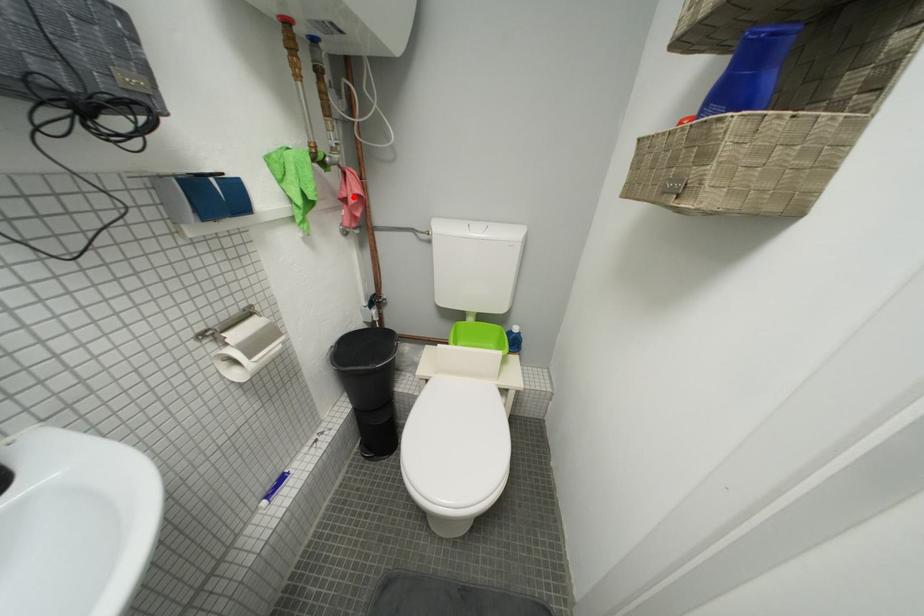
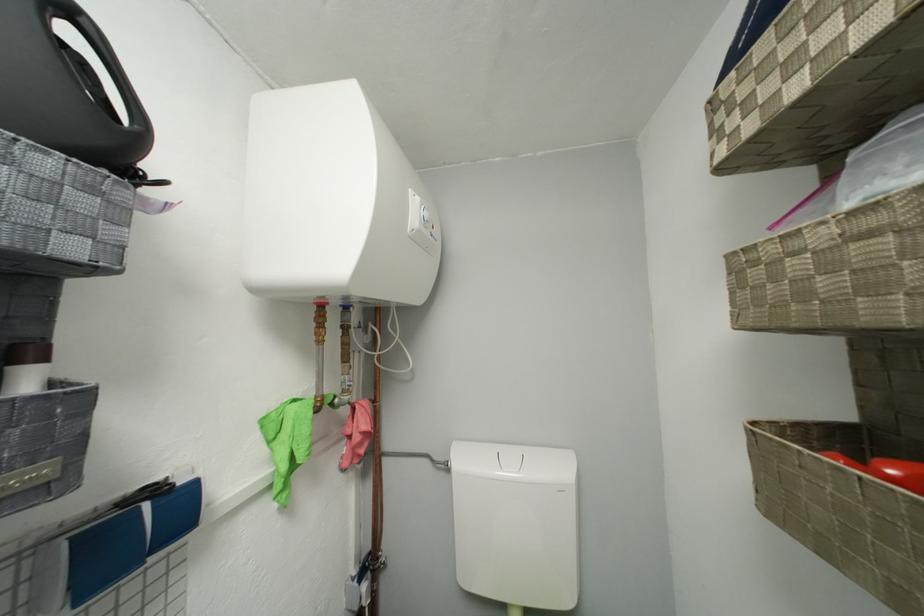
The point at the highlighted location is marked in the first image. Where is the corresponding point in the second image?

(358, 435)